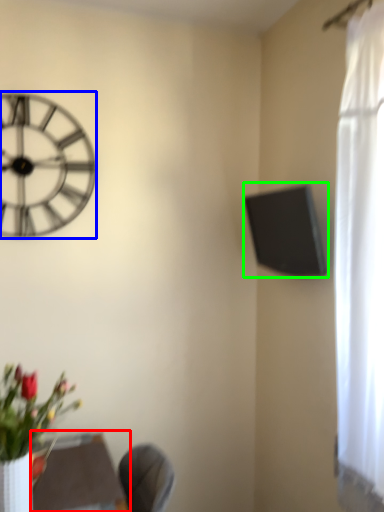
Question: Considering the real-world distances, which object is farthest from round table (highlighted by a red box)? wall clock (highlighted by a blue box) or window screen (highlighted by a green box)?

Choices:
 (A) wall clock
 (B) window screen

Answer: (B)